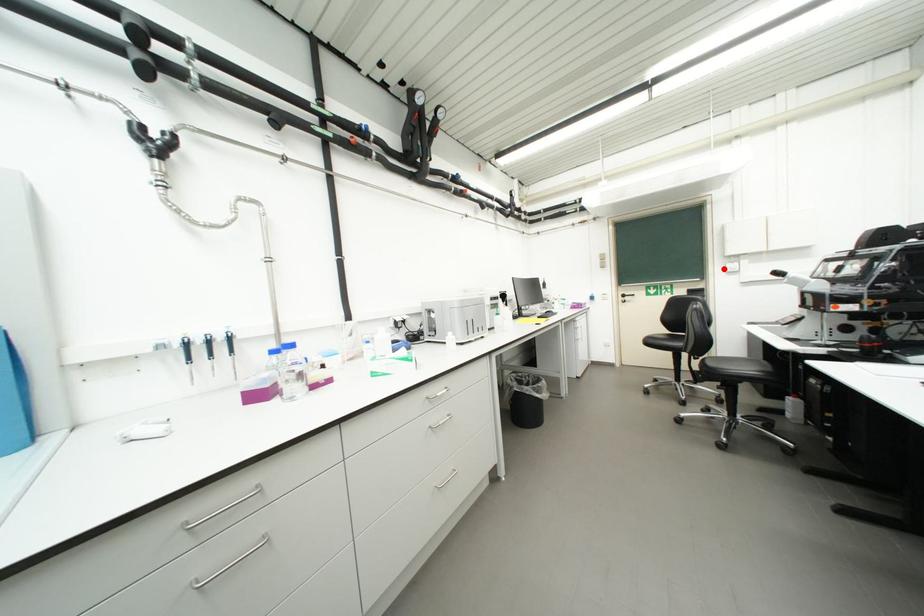
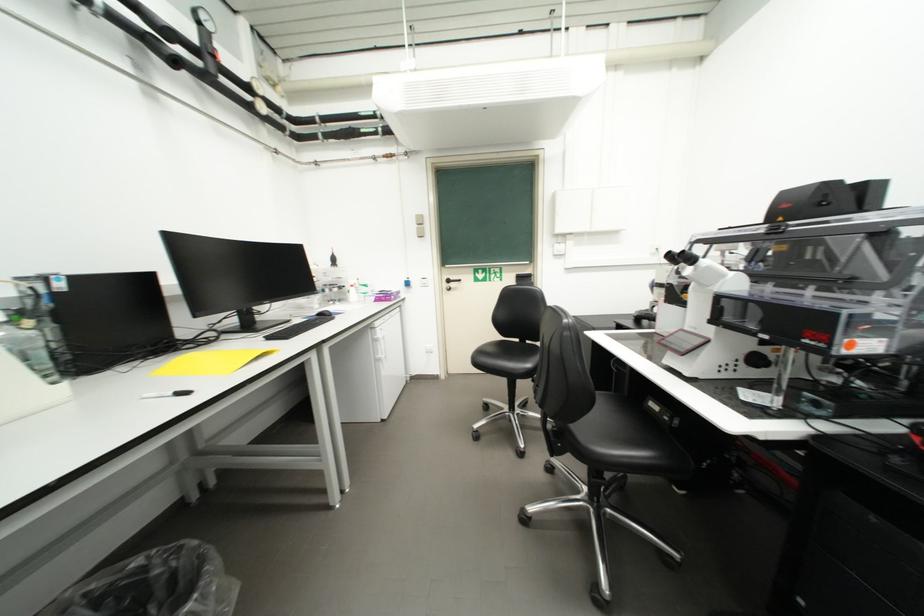
The point at the highlighted location is marked in the first image. Where is the corresponding point in the second image?

(553, 249)